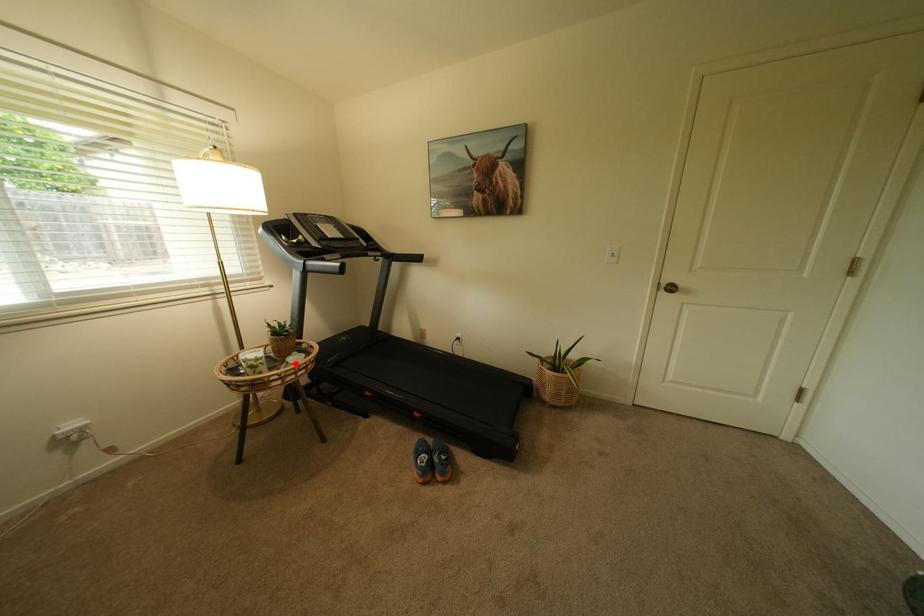
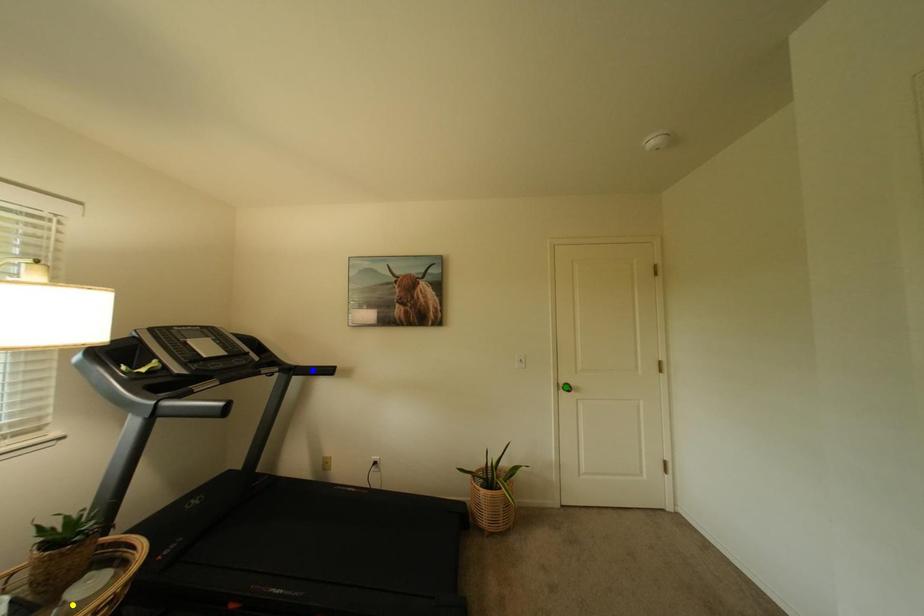
Question: I am providing you with two images of the same scene from different viewpoints. A red point is marked on the first image. You are given multiple points on the second image. Which point in image 2 is actually the same real-world point as the red point in image 1?

Choices:
 (A) green point
 (B) blue point
 (C) yellow point

Answer: (C)